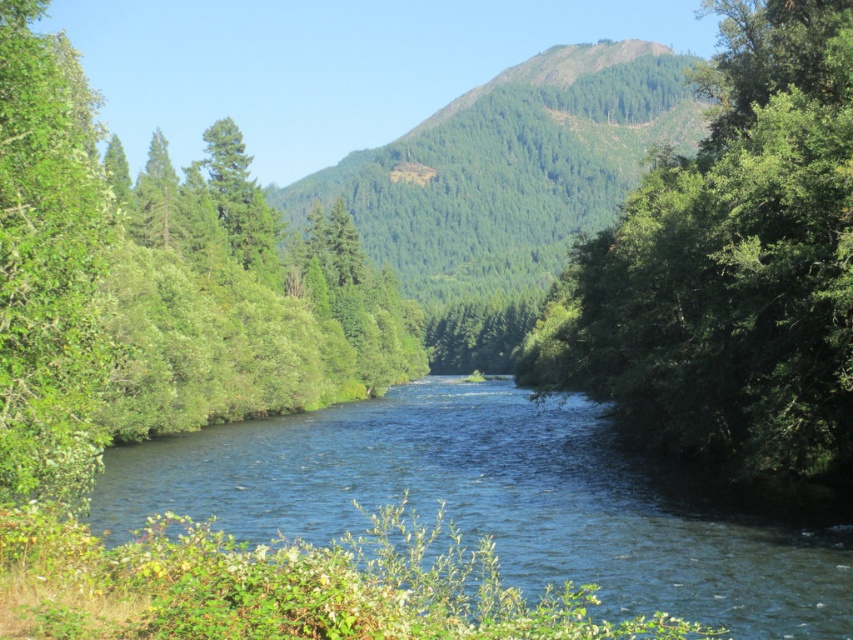
Is green leafy tree at center wider than green leafy tree at left?

In fact, green leafy tree at center might be narrower than green leafy tree at left.

Is green leafy tree at center taller than green leafy tree at left?

Yes.

Locate an element on the screen. This screenshot has height=640, width=853. green leafy tree at center is located at coordinates (729, 264).

Between blue water at center and green leafy tree at left, which one is positioned lower?

Positioned lower is blue water at center.

This screenshot has height=640, width=853. What do you see at coordinates (494, 500) in the screenshot?
I see `blue water at center` at bounding box center [494, 500].

Where is `blue water at center`? This screenshot has height=640, width=853. blue water at center is located at coordinates point(494,500).

Who is positioned more to the left, green leafy tree at center or green textured trees at center?

Positioned to the left is green textured trees at center.

Who is higher up, green leafy tree at center or green textured trees at center?

green leafy tree at center

Based on the photo, who is more distant from viewer, (822,227) or (434,316)?

The point (434,316) is behind.

Where is `green leafy tree at center`? The width and height of the screenshot is (853, 640). green leafy tree at center is located at coordinates (729, 264).